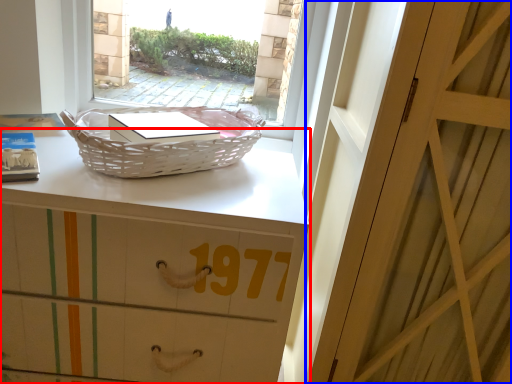
Question: Which object is closer to the camera taking this photo, desk (highlighted by a red box) or door (highlighted by a blue box)?

Choices:
 (A) desk
 (B) door

Answer: (B)